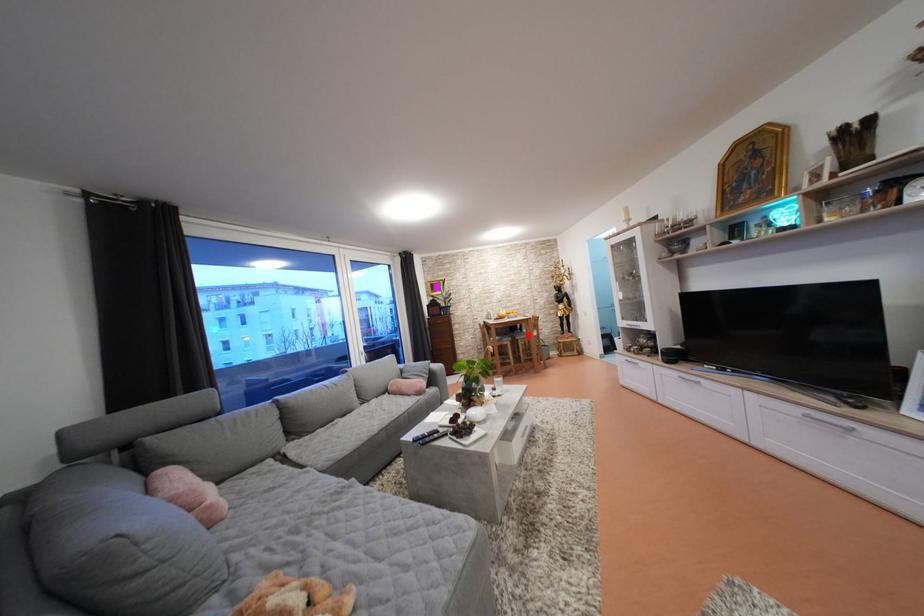
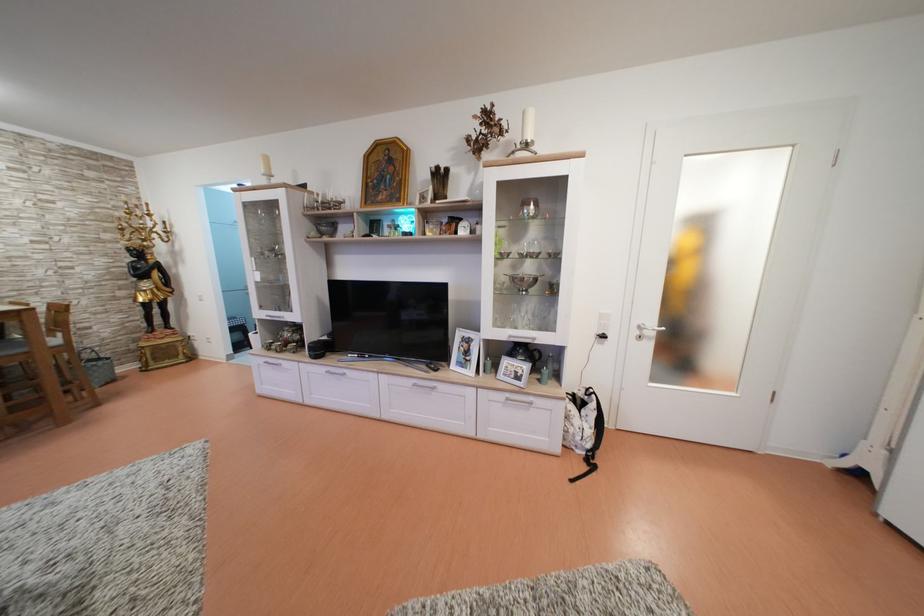
Question: A red point is marked in image1. In image2, is the corresponding 3D point closer to the camera or farther? Reply with the corresponding letter.

Choices:
 (A) The corresponding 3D point is closer.
 (B) The corresponding 3D point is farther.

Answer: (B)